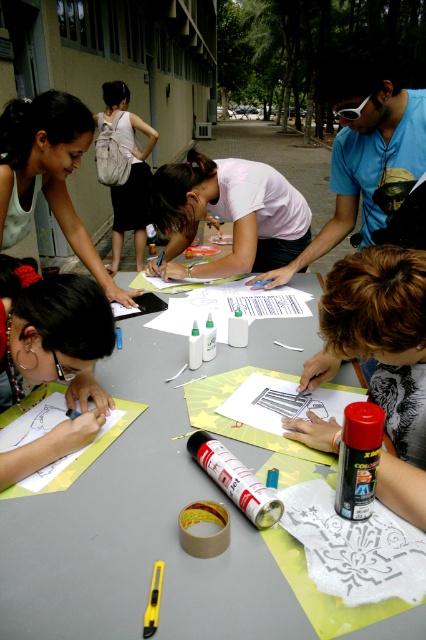
Question: Which point is farther to the camera?

Choices:
 (A) blue cotton shirt at upper right
 (B) matte black hair at center
 (C) gray matte table at center

Answer: (A)

Question: Does gray matte table at center appear under matte white tank top at upper left?

Choices:
 (A) yes
 (B) no

Answer: (A)

Question: Among these objects, which one is nearest to the camera?

Choices:
 (A) blue cotton shirt at upper right
 (B) matte white spray can at center

Answer: (B)

Question: Does matte black hair at center have a lesser width compared to white fabric backpack at upper left?

Choices:
 (A) no
 (B) yes

Answer: (B)

Question: Which of the following is the farthest from the observer?

Choices:
 (A) (106, 166)
 (B) (307, 436)

Answer: (A)

Question: Is gray matte table at center to the right of white matte shirt at center from the viewer's perspective?

Choices:
 (A) no
 (B) yes

Answer: (A)